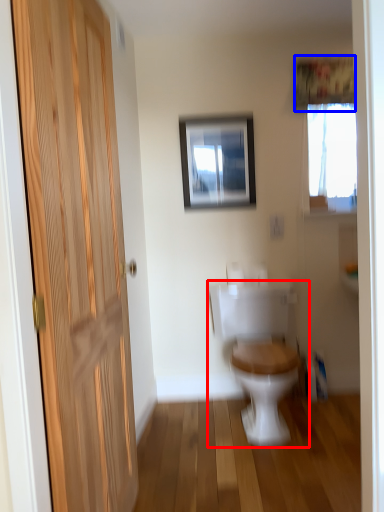
Question: Which of the following is the farthest to the observer, toilet (highlighted by a red box) or curtain (highlighted by a blue box)?

Choices:
 (A) toilet
 (B) curtain

Answer: (B)